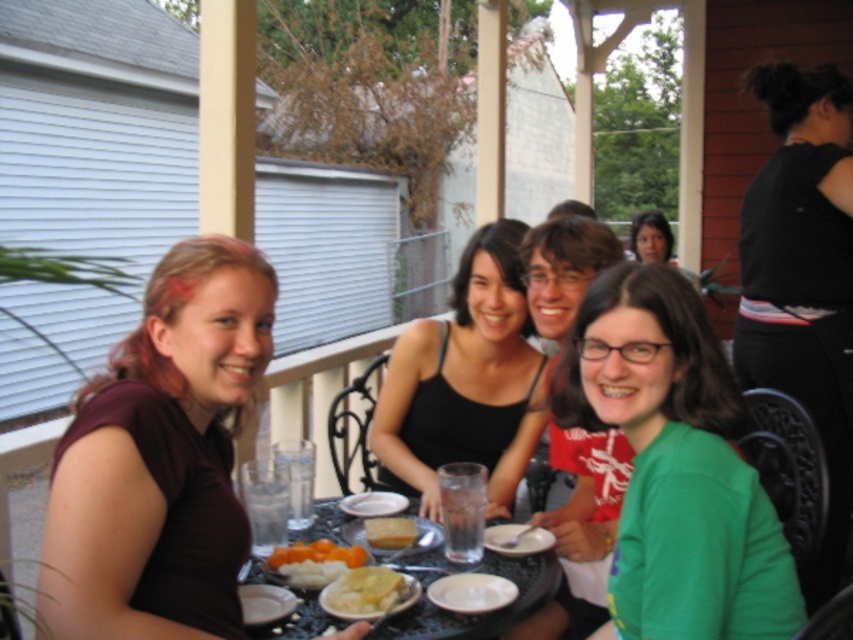
You are a photographer trying to capture a candid shot of the group without them noticing. You want to position yourself behind the black matte tank top at center so that the translucent glass table at center doesn t block your view. Is this possible?

The black matte tank top at center is much taller than the translucent glass table at center, so positioning yourself behind the black matte tank top at center would block your view since the tank top is taller and would obscure the view through the table.